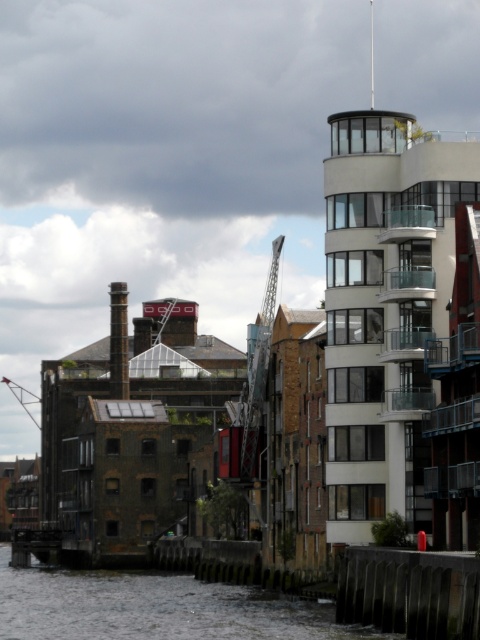
You are a photographer positioned at the camera location. You want to capture a closeup shot of the gray concrete river at lower left. Considering the distance, do you think you can focus on it clearly without moving your position?

The gray concrete river at lower left is 77.59 meters from camera, so it may be challenging to focus on it clearly from your current position without moving closer.

Based on the provided scene description, where is the gray concrete river at lower left located in the image?

The gray concrete river at lower left is located at point (154, 609).

You are a delivery truck driver who needs to unload cargo near the gray concrete river at lower left. The metallic gray crane at left is available for assistance. Based on their positions, can the crane reach the river to help with the unloading process?

The gray concrete river at lower left is located below the metallic gray crane at left, so the crane can likely reach down to the river to assist with unloading the cargo.